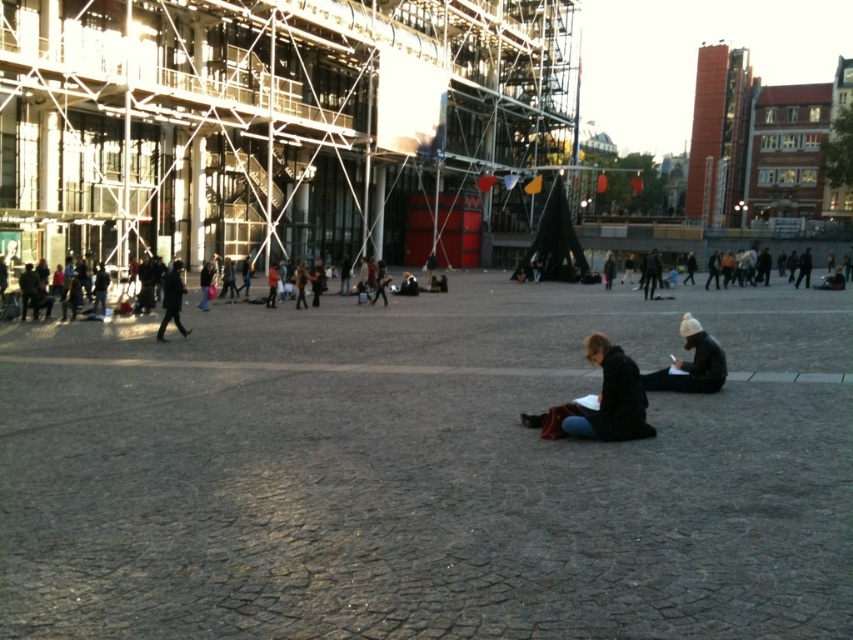
You are a delivery person who needs to place a small package between the jeans at center and the white knit hat at center. The package measures 1 foot in length. Is there enough space to place it without moving either item?

The distance between the jeans at center and the white knit hat at center is 11.92 feet, which is more than enough space to place the 1 foot long package between them without moving either item.

You are a photographer trying to capture a candid shot of the jeans at center and the white knit hat at center in the plaza. Since you want both items to appear equally prominent in the photo, which object should you zoom in on more to balance their sizes?

The jeans at center is larger than the white knit hat at center. To balance their sizes in the photo, you should zoom in more on the white knit hat at center so it appears larger in the frame, while keeping the jeans at center at a distance to maintain its size.

Looking at this image, you are a photographer standing in the plaza and want to take a photo that includes both the white knit hat at center and the dark gray coat at left. Since you want both subjects to be clearly visible in the frame, does the current arrangement allow this?

The white knit hat at center is in front of the dark gray coat at left, so the photographer can capture both subjects clearly as they are not overlapping.